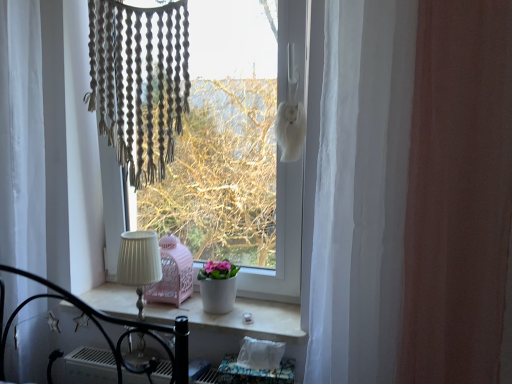
Question: Is point (361, 165) closer or farther from the camera than point (99, 13)?

Choices:
 (A) farther
 (B) closer

Answer: (B)

Question: Considering the positions of white sheer curtain at right, which appears as the first curtain when viewed from the front, and white matte window at center in the image, is white sheer curtain at right, which appears as the first curtain when viewed from the front, bigger or smaller than white matte window at center?

Choices:
 (A) small
 (B) big

Answer: (A)

Question: Which object is the closest to the white matte window at center?

Choices:
 (A) white sheer curtain at left, the 2th curtain from the front
 (B) white matte pot at center
 (C) white ceramic window sill at center
 (D) white sheer curtain at right, which appears as the 2th curtain when viewed from the left
 (E) white pleated fabric at center

Answer: (B)

Question: Considering the real-world distances, which object is farthest from the white pleated fabric at center?

Choices:
 (A) white sheer curtain at left, the 1th curtain when ordered from left to right
 (B) white ceramic window sill at center
 (C) white matte pot at center
 (D) white matte window at center
 (E) white sheer curtain at right, which is counted as the 2th curtain, starting from the back

Answer: (E)